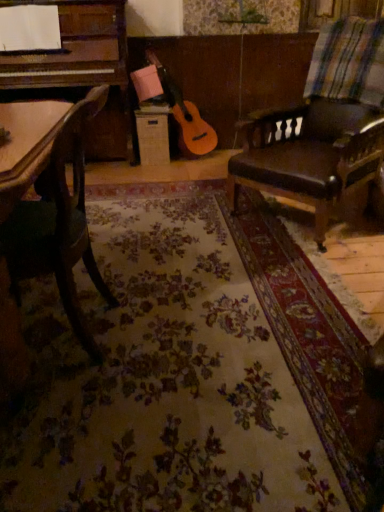
Question: Looking at the image, does green fabric chair at left, which is the second chair from right to left, seem bigger or smaller compared to multicolored woven blanket at upper right?

Choices:
 (A) big
 (B) small

Answer: (A)

Question: Is point (49, 230) positioned closer to the camera than point (354, 48)?

Choices:
 (A) closer
 (B) farther

Answer: (A)

Question: Which of these objects is positioned farthest from the multicolored woven blanket at upper right?

Choices:
 (A) green fabric chair at left, which is counted as the 1th chair, starting from the front
 (B) leather cushioned chair at right, the second chair positioned from the left

Answer: (A)

Question: Based on their relative distances, which object is farther from the green fabric chair at left, the second chair from the back?

Choices:
 (A) multicolored woven blanket at upper right
 (B) leather cushioned chair at right, which appears as the first chair when viewed from the back

Answer: (A)